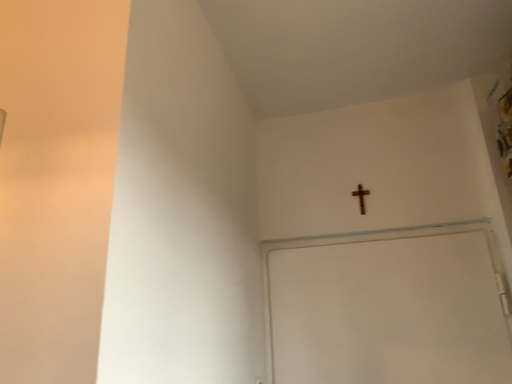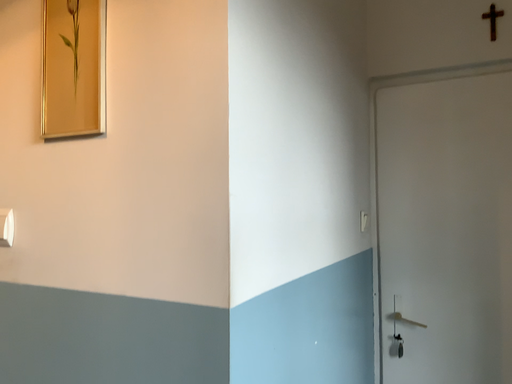
Question: How did the camera likely rotate when shooting the video?

Choices:
 (A) rotated left
 (B) rotated right

Answer: (A)